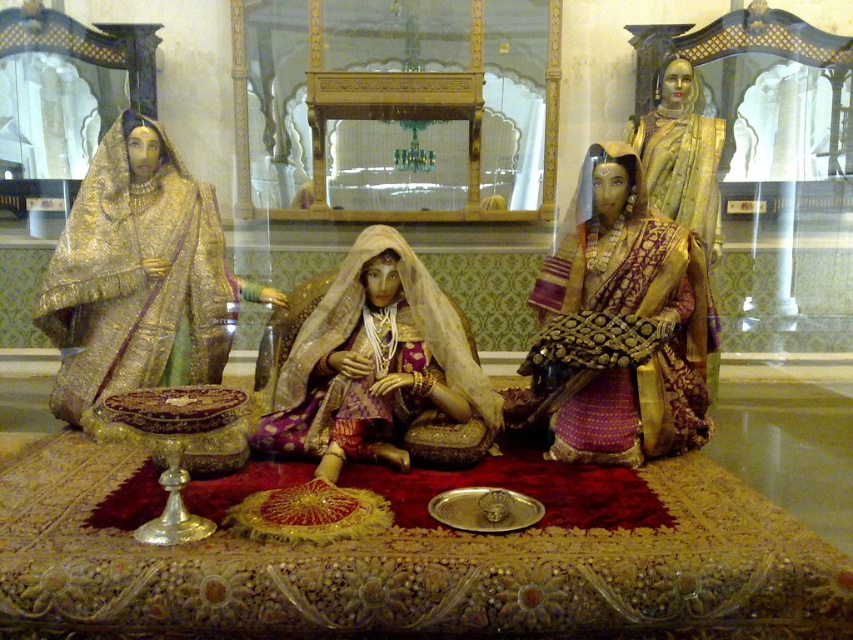
Question: Among these points, which one is nearest to the camera?

Choices:
 (A) (670, 99)
 (B) (628, 410)

Answer: (B)

Question: Is gold silk saree at center below matte gold fabric at center?

Choices:
 (A) no
 (B) yes

Answer: (A)

Question: Is gold silk saree at center to the left of matte gold fabric at center from the viewer's perspective?

Choices:
 (A) yes
 (B) no

Answer: (B)

Question: Which point is farther from the camera taking this photo?

Choices:
 (A) (706, 234)
 (B) (386, 307)

Answer: (A)

Question: Which point is farther to the camera?

Choices:
 (A) (421, 392)
 (B) (606, 323)
 (C) (683, 211)

Answer: (C)

Question: Can you confirm if matte gold fabric at center is positioned above gold silk saree at upper right?

Choices:
 (A) yes
 (B) no

Answer: (B)